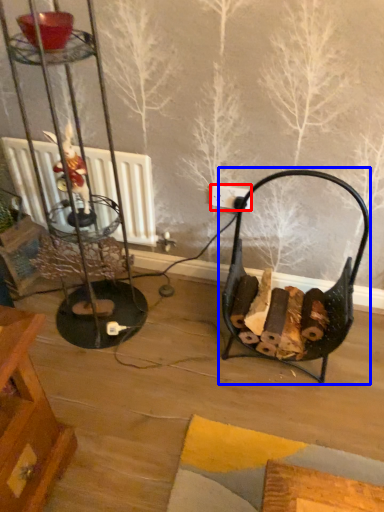
Question: Which of the following is the farthest to the observer, electric outlet (highlighted by a red box) or armchair (highlighted by a blue box)?

Choices:
 (A) electric outlet
 (B) armchair

Answer: (A)